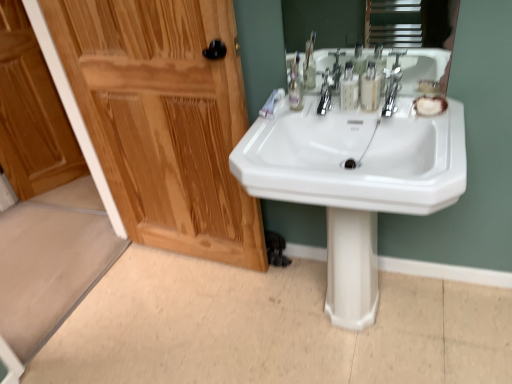
This screenshot has width=512, height=384. In order to click on free space above white glossy pedestal at center (from a real-world perspective) in this screenshot , I will do `click(359, 162)`.